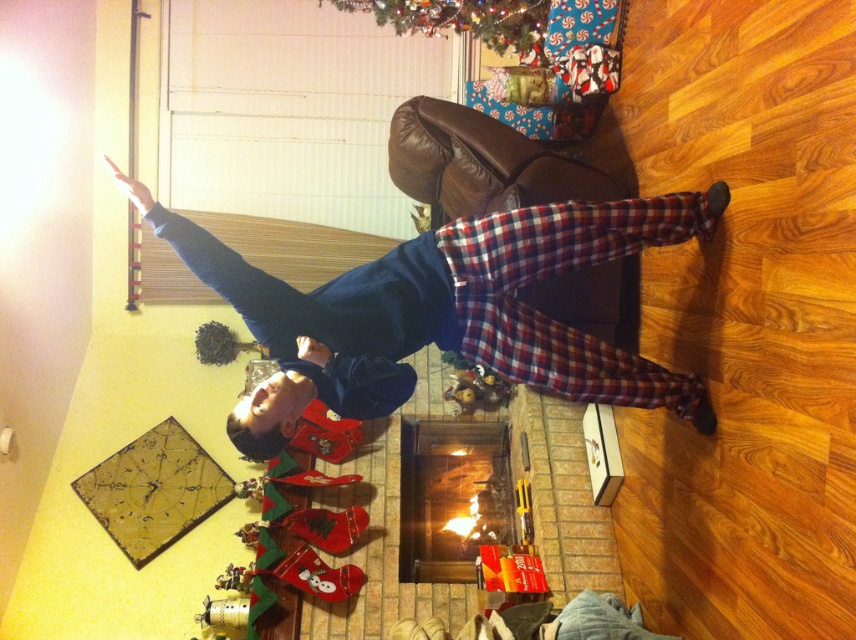
Question: Is plaid fabric pants at center above green matte christmas tree at upper center?

Choices:
 (A) no
 (B) yes

Answer: (A)

Question: Can you confirm if plaid fabric pants at center is positioned above brick fireplace at center?

Choices:
 (A) no
 (B) yes

Answer: (B)

Question: Considering the real-world distances, which object is farthest from the green matte christmas tree at upper center?

Choices:
 (A) plaid fabric pants at center
 (B) brick fireplace at center

Answer: (B)

Question: Among these objects, which one is nearest to the camera?

Choices:
 (A) green matte christmas tree at upper center
 (B) plaid fabric pants at center
 (C) brick fireplace at center

Answer: (B)

Question: Which point appears farthest from the camera in this image?

Choices:
 (A) (390, 371)
 (B) (465, 490)
 (C) (467, 12)

Answer: (B)

Question: Is brick fireplace at center bigger than green matte christmas tree at upper center?

Choices:
 (A) yes
 (B) no

Answer: (A)